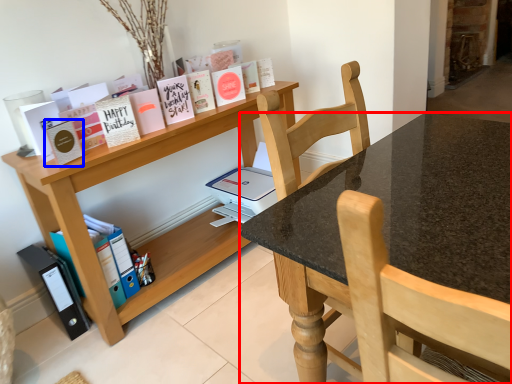
Question: Which object is closer to the camera taking this photo, desk (highlighted by a red box) or paperback book (highlighted by a blue box)?

Choices:
 (A) desk
 (B) paperback book

Answer: (A)